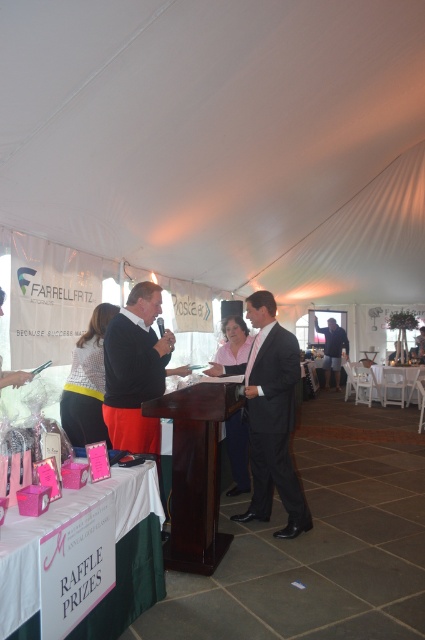
You are organizing a raffle event and need to place a large banner on the wooden podium at center or the pink fabric at center. Based on their sizes, which surface can accommodate the banner without it hanging over the edges?

The wooden podium at center is larger in size than the pink fabric at center, so the banner should be placed on the wooden podium at center to ensure it fits without overhanging.

You are at the entrance of the tent and want to find the raffle prizes. Which direction should you move relative to the man standing at point (116, 556)?

You should move towards the lower left direction relative to the man standing at point (116, 556) because the white fabric tablecloth at lower left holds the raffle prizes.

You are a guest at the event and want to place a raffle ticket on the table. The wooden podium at center and the pink fabric at center are both on the table. Which object has a wider base so you can place your ticket there?

The wooden podium at center has a wider base than the pink fabric at center, so you can place your ticket there.